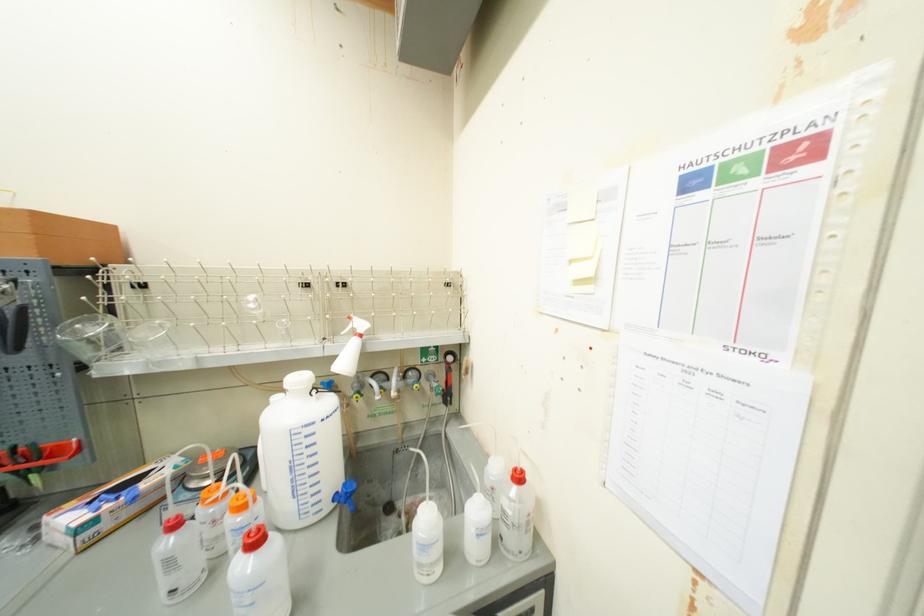
Locate an element on the screen. The height and width of the screenshot is (616, 924). white spray trigger is located at coordinates (335, 344).